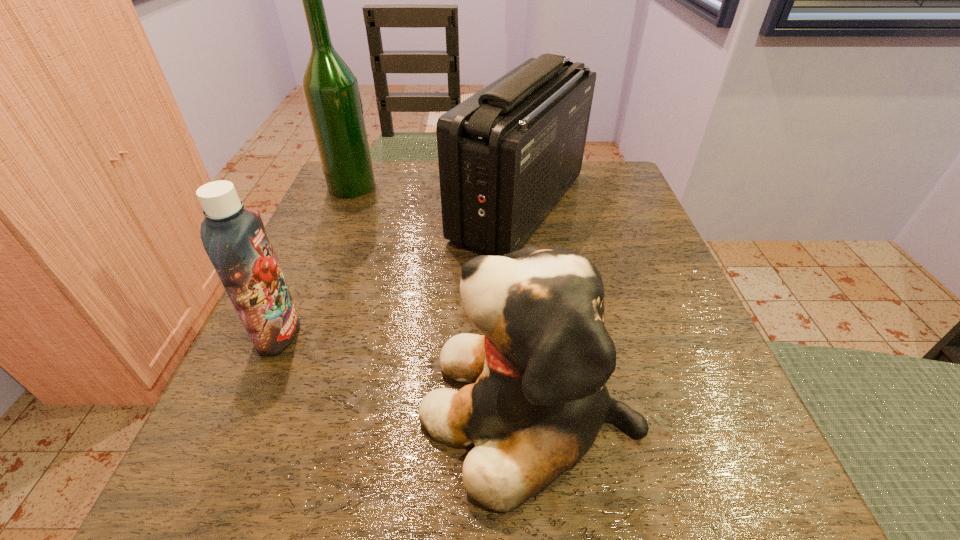
Identify the location of vacant position located 0.060m at the face of the puppy. The image size is (960, 540). (377, 408).

At what (x,y) coordinates should I click in order to perform the action: click on vacant space located 0.250m at the face of the puppy. Please return your answer as a coordinate pair (x, y). Looking at the image, I should click on (241, 408).

The height and width of the screenshot is (540, 960). What are the coordinates of `alcohol located in the far edge section of the desktop` in the screenshot? It's located at (331, 91).

At what (x,y) coordinates should I click in order to perform the action: click on radio receiver at the far edge. Please return your answer as a coordinate pair (x, y). Looking at the image, I should click on (507, 155).

The width and height of the screenshot is (960, 540). In order to click on object that is at the near edge in this screenshot , I will do `click(538, 400)`.

The width and height of the screenshot is (960, 540). In order to click on alcohol at the left edge in this screenshot , I will do `click(331, 91)`.

The height and width of the screenshot is (540, 960). What are the coordinates of `shampoo present at the left edge` in the screenshot? It's located at (235, 239).

Find the location of a particular element. This screenshot has height=540, width=960. radio receiver positioned at the right edge is located at coordinates (507, 155).

Find the location of a particular element. puppy located in the right edge section of the desktop is located at coordinates (538, 400).

You are a GUI agent. You are given a task and a screenshot of the screen. Output one action in this format:
    pyautogui.click(x=<x>, y=<y>)
    Task: Click on the object that is at the far left corner
    The image size is (960, 540).
    Given the screenshot: What is the action you would take?
    pyautogui.click(x=331, y=91)